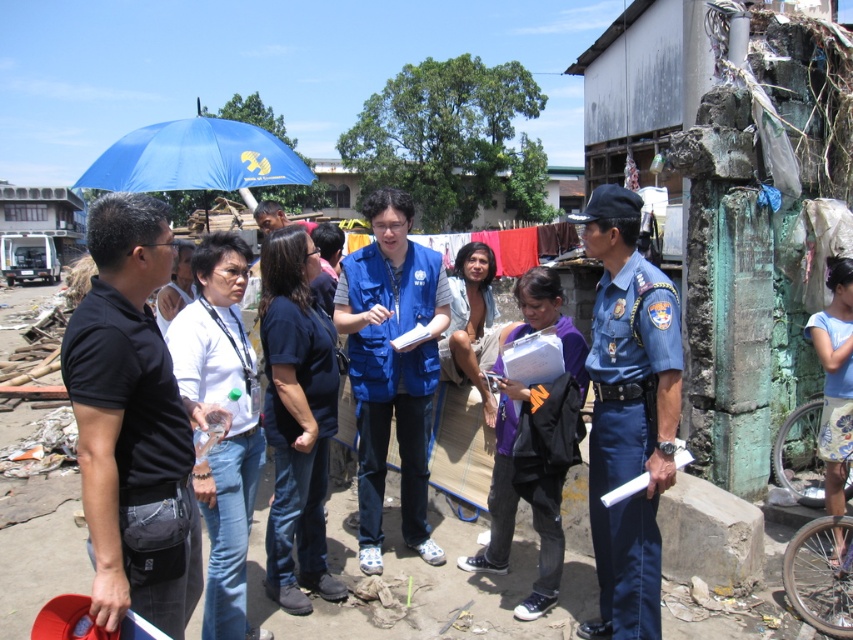
Question: Which object is closer to the camera taking this photo?

Choices:
 (A) blue fabric umbrella at upper left
 (B) blue uniform at center
 (C) blue fabric vest at center

Answer: (B)

Question: Does black matte shirt at left have a lesser width compared to blue uniform at center?

Choices:
 (A) no
 (B) yes

Answer: (A)

Question: Observing the image, what is the correct spatial positioning of black matte shirt at left in reference to blue fabric umbrella at upper left?

Choices:
 (A) right
 (B) left

Answer: (A)

Question: Which point is closer to the camera?

Choices:
 (A) black matte shirt at left
 (B) blue fabric vest at center
 (C) blue fabric umbrella at upper left
 (D) blue uniform at center

Answer: (A)

Question: Among these objects, which one is farthest from the camera?

Choices:
 (A) blue fabric umbrella at upper left
 (B) black matte shirt at left

Answer: (A)

Question: Can you confirm if black matte shirt at left is wider than blue fabric umbrella at upper left?

Choices:
 (A) no
 (B) yes

Answer: (A)